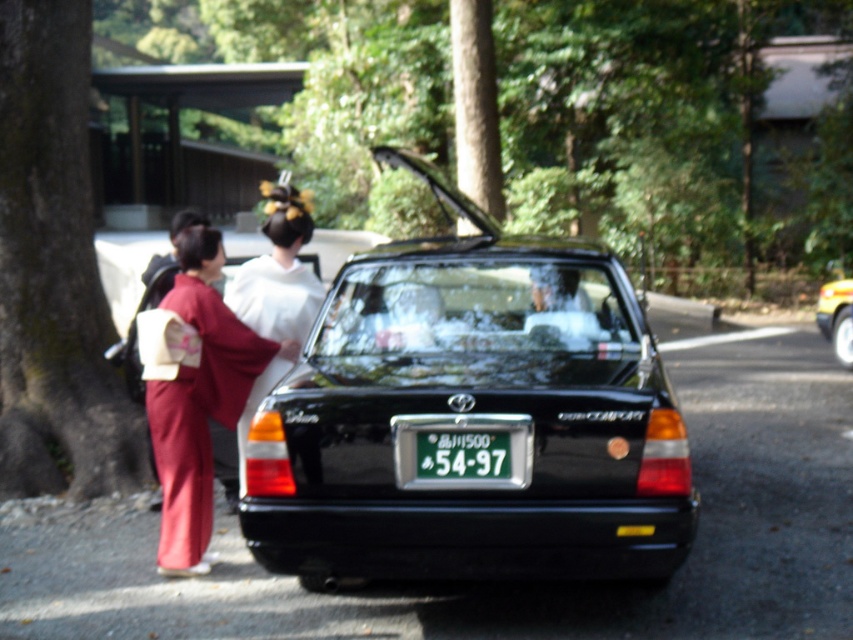
Question: Does black glossy sedan at center appear over green metallic license plate at center?

Choices:
 (A) no
 (B) yes

Answer: (B)

Question: Is silky red kimono at left behind metallic gold car at center?

Choices:
 (A) no
 (B) yes

Answer: (A)

Question: Which object appears closest to the camera in this image?

Choices:
 (A) silky red kimono at left
 (B) white silk kimono at center
 (C) green metallic license plate at center

Answer: (C)

Question: Which of the following is the closest to the observer?

Choices:
 (A) (74, 243)
 (B) (831, 308)
 (C) (525, 454)
 (D) (432, 172)

Answer: (C)

Question: Is smooth bark tree at left positioned behind green metallic license plate at center?

Choices:
 (A) yes
 (B) no

Answer: (A)

Question: Which object appears farthest from the camera in this image?

Choices:
 (A) smooth bark tree at left
 (B) green metallic license plate at center
 (C) white silk kimono at center
 (D) silky red kimono at left

Answer: (A)